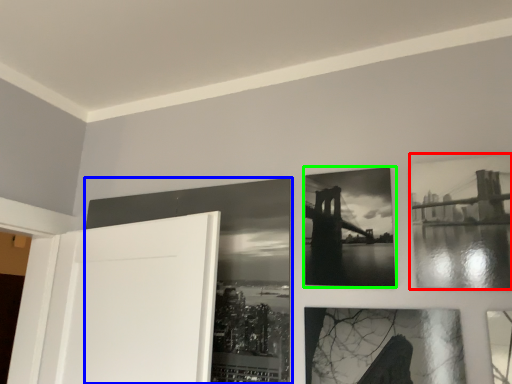
Question: Based on their relative distances, which object is nearer to picture frame (highlighted by a red box)? Choose from picture frame (highlighted by a blue box) and picture frame (highlighted by a green box).

Choices:
 (A) picture frame
 (B) picture frame

Answer: (B)